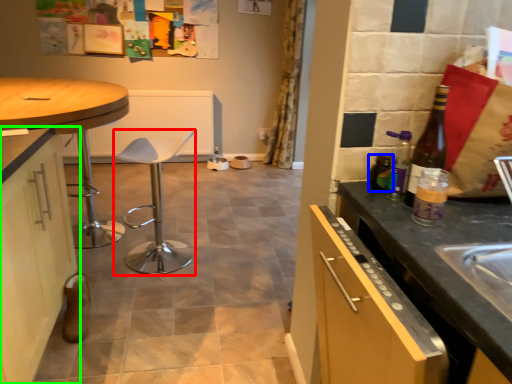
Question: Estimate the real-world distances between objects in this image. Which object is closer to bar stool (highlighted by a red box), bottle (highlighted by a blue box) or cabinetry (highlighted by a green box)?

Choices:
 (A) bottle
 (B) cabinetry

Answer: (B)